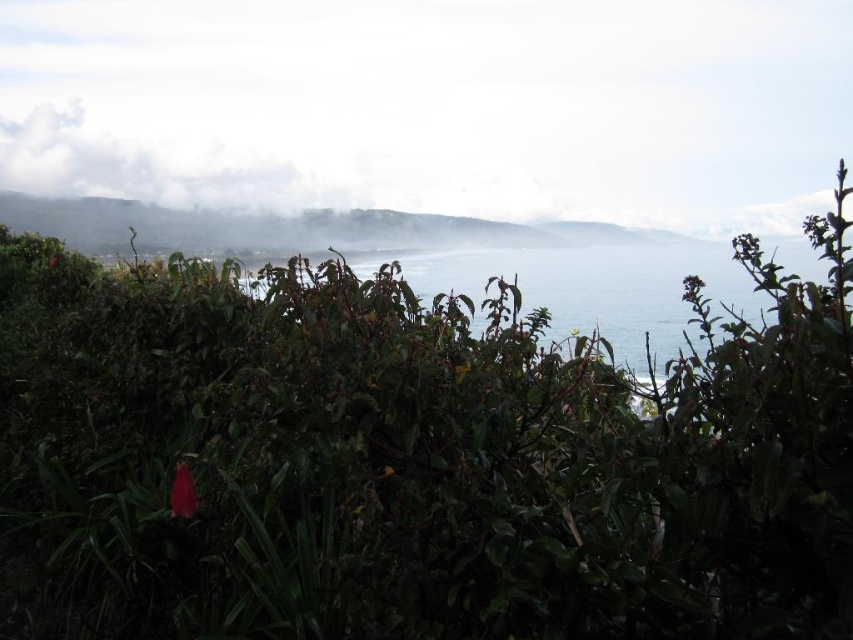
Question: Is white misty cloud at upper center to the right of white fluffy cloud at upper left from the viewer's perspective?

Choices:
 (A) yes
 (B) no

Answer: (A)

Question: Which of the following is the closest to the observer?

Choices:
 (A) blue water at center
 (B) green leafy bush at center

Answer: (B)

Question: Which object is the closest to the blue water at center?

Choices:
 (A) white fluffy cloud at upper left
 (B) white misty cloud at upper center

Answer: (B)

Question: Does blue water at center lie in front of white fluffy cloud at upper left?

Choices:
 (A) no
 (B) yes

Answer: (B)

Question: Is white misty cloud at upper center positioned before blue water at center?

Choices:
 (A) no
 (B) yes

Answer: (A)

Question: Among these points, which one is nearest to the camera?

Choices:
 (A) (299, 8)
 (B) (776, 339)

Answer: (B)